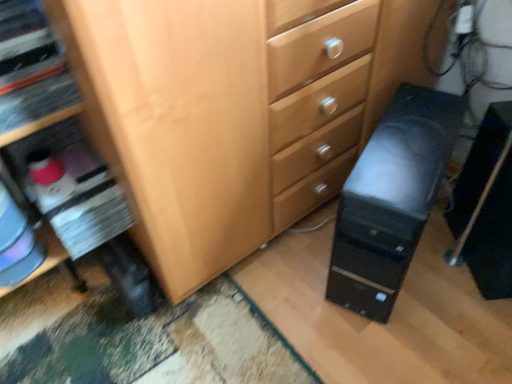
Identify the location of free point in front of black plastic computer tower at lower right, which is the first computer tower from left to right. (412, 332).